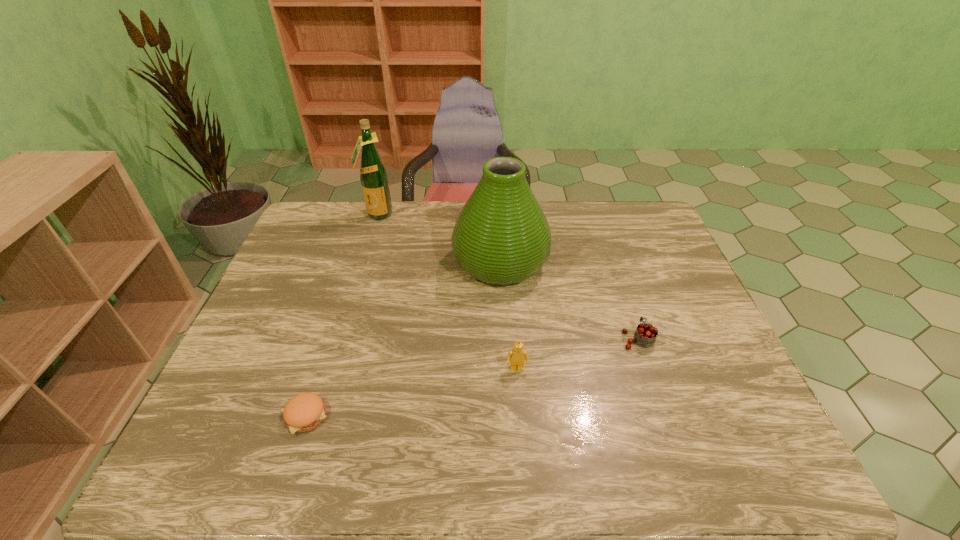
Locate an element on the screen. blank area located 0.360m on the handle side of the cherry is located at coordinates (605, 243).

Image resolution: width=960 pixels, height=540 pixels. What are the coordinates of `vacant position located 0.210m on the handle side of the cherry` in the screenshot? It's located at (615, 274).

The height and width of the screenshot is (540, 960). I want to click on vacant area located 0.100m on the handle side of the cherry, so click(x=624, y=300).

Image resolution: width=960 pixels, height=540 pixels. What are the coordinates of `free region located 0.120m on the back of the nearest object` in the screenshot? It's located at (325, 354).

I want to click on liquor at the far edge, so click(374, 181).

Find the location of a particular element. The width and height of the screenshot is (960, 540). vase present at the far edge is located at coordinates (501, 236).

Locate an element on the screen. The height and width of the screenshot is (540, 960). object that is at the near edge is located at coordinates (304, 412).

At what (x,y) coordinates should I click in order to perform the action: click on blank space at the far edge. Please return your answer as a coordinate pair (x, y). Looking at the image, I should click on (399, 241).

At what (x,y) coordinates should I click in order to perform the action: click on vacant space at the near edge of the desktop. Please return your answer as a coordinate pair (x, y). The image size is (960, 540). Looking at the image, I should click on (483, 448).

In the image, there is a desktop. Where is `vacant space at the left edge`? This screenshot has width=960, height=540. vacant space at the left edge is located at coordinates (248, 378).